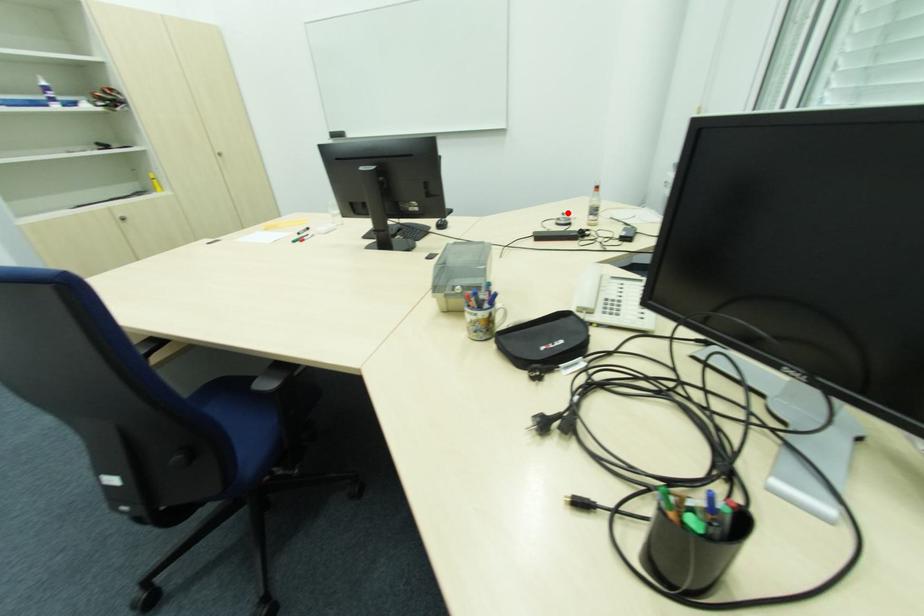
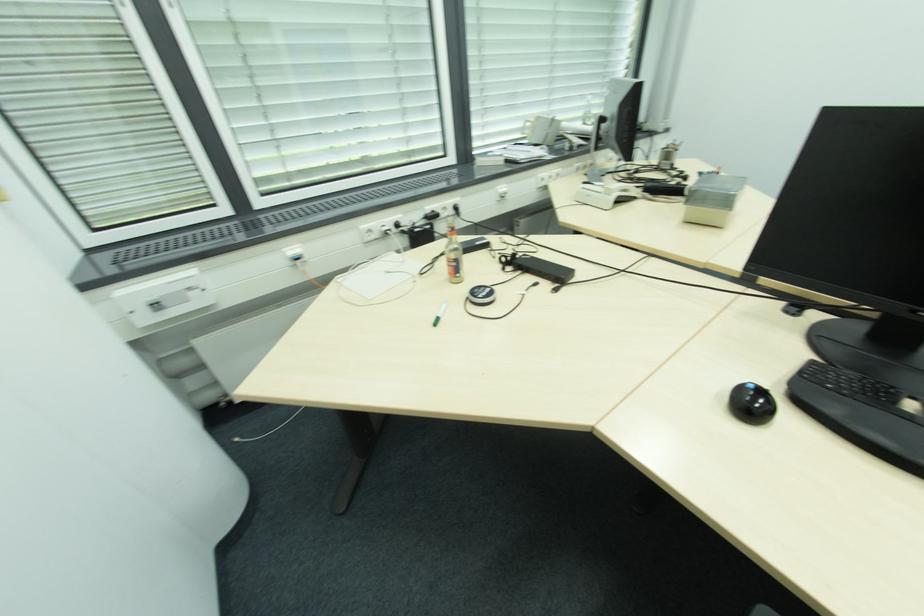
Locate, in the second image, the point that corresponds to the highlighted location in the first image.

(436, 321)